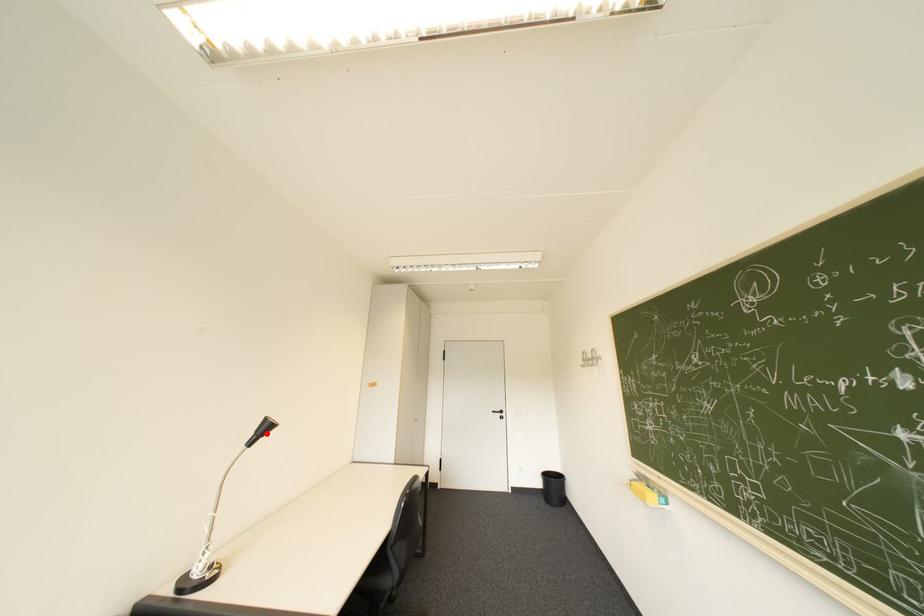
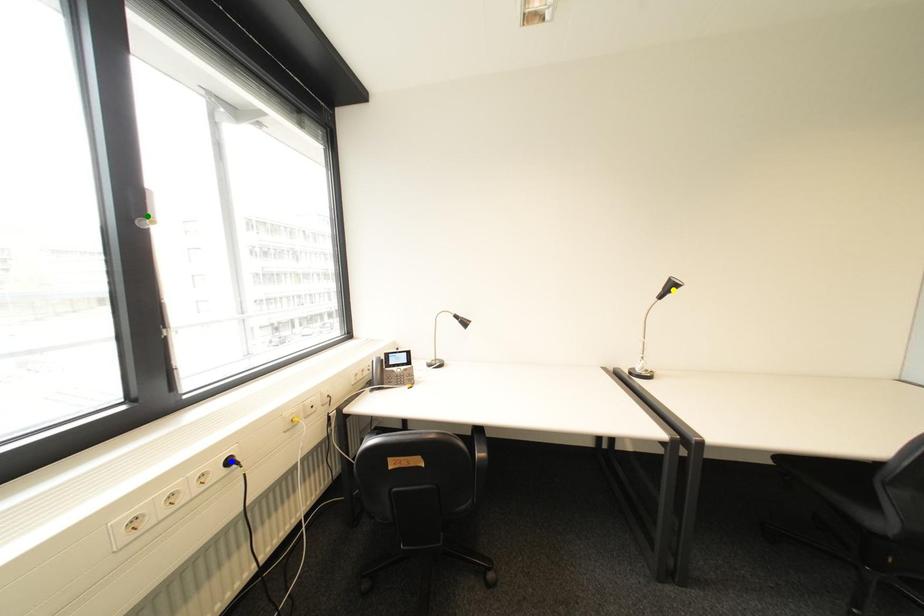
Question: I am providing you with two images of the same scene from different viewpoints. A red point is marked on the first image. You are given multiple points on the second image. Can you choose the point in image 2 that corresponds to the point in image 1?

Choices:
 (A) yellow point
 (B) blue point
 (C) green point

Answer: (A)